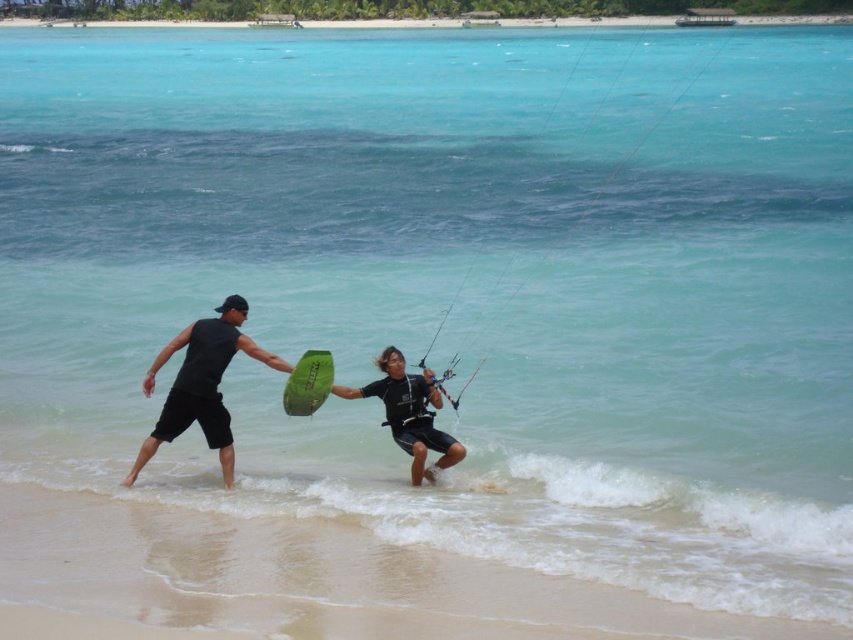
Based on the photo, you are a photographer trying to capture the best shot of the sandy beach at lower center and the green matte surfboard at center. Based on their positions, which object should you focus on first to ensure it appears in the foreground of your photo?

The sandy beach at lower center is in front of the green matte surfboard at center, so focusing on the sandy beach at lower center first will ensure it appears in the foreground.

You are a photographer trying to capture a photo of the sandy beach at lower center and the green matte surfboard at center. Which object should you focus on first if you want to ensure both are in the frame without moving the camera? Explain your reasoning based on their heights.

The sandy beach at lower center has a lesser height compared to the green matte surfboard at center. Therefore, you should focus on the sandy beach at lower center first to ensure it is fully captured in the frame before the surfboard might block it.